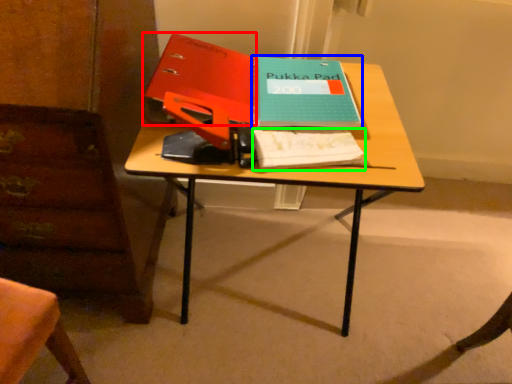
Question: Which object is the closest to the paperback book (highlighted by a red box)? Choose among these: paperback book (highlighted by a blue box) or notebook (highlighted by a green box).

Choices:
 (A) paperback book
 (B) notebook

Answer: (A)